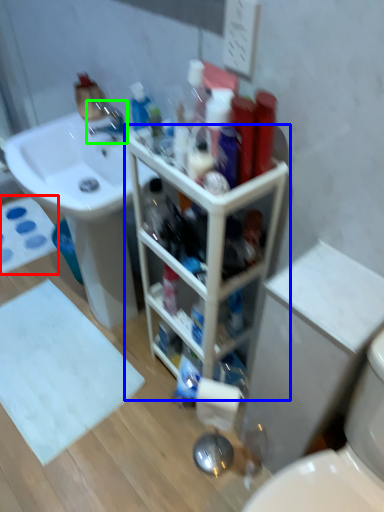
Question: Which object is the farthest from bath mat (highlighted by a red box)? Choose among these: bathroom cabinet (highlighted by a blue box) or tap (highlighted by a green box).

Choices:
 (A) bathroom cabinet
 (B) tap

Answer: (A)